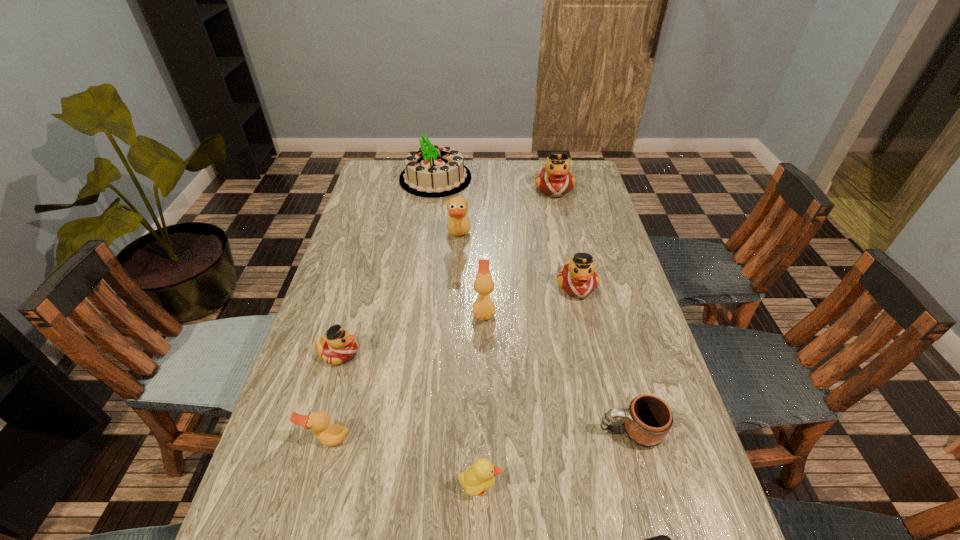
At what (x,y) coordinates should I click in order to perform the action: click on unoccupied area between the nearest tan duck and the second nearest object. Please return your answer as a coordinate pair (x, y). The image size is (960, 540). Looking at the image, I should click on pyautogui.click(x=403, y=463).

This screenshot has height=540, width=960. I want to click on free space between the second farthest red duck and the yellow duckling, so pyautogui.click(x=528, y=386).

You are a GUI agent. You are given a task and a screenshot of the screen. Output one action in this format:
    pyautogui.click(x=<x>, y=<y>)
    Task: Click on the vacant area between the yellow duckling and the biggest red duck
    
    Given the screenshot: What is the action you would take?
    pyautogui.click(x=517, y=338)

At what (x,y) coordinates should I click in order to perform the action: click on empty space that is in between the second nearest object and the leftmost red duck. Please return your answer as a coordinate pair (x, y). The width and height of the screenshot is (960, 540). Looking at the image, I should click on (409, 420).

Identify which object is the eighth closest to the nearest object. Please provide its 2D coordinates. Your answer should be formatted as a tuple, i.e. [(x, y)], where the tuple contains the x and y coordinates of a point satisfying the conditions above.

[(555, 180)]

Find the location of a particular element. object that stands as the closest to the second farthest duck is located at coordinates (431, 171).

I want to click on duck identified as the fifth closest to the nearest tan duck, so click(x=555, y=180).

Where is `duck that is the fifth closest one to the shortest object`? The image size is (960, 540). duck that is the fifth closest one to the shortest object is located at coordinates (458, 224).

Identify which red duck is the nearest to the yellow duckling. Please provide its 2D coordinates. Your answer should be formatted as a tuple, i.e. [(x, y)], where the tuple contains the x and y coordinates of a point satisfying the conditions above.

[(338, 346)]

Point out which red duck is positioned as the second nearest to the nearest red duck. Please provide its 2D coordinates. Your answer should be formatted as a tuple, i.e. [(x, y)], where the tuple contains the x and y coordinates of a point satisfying the conditions above.

[(555, 180)]